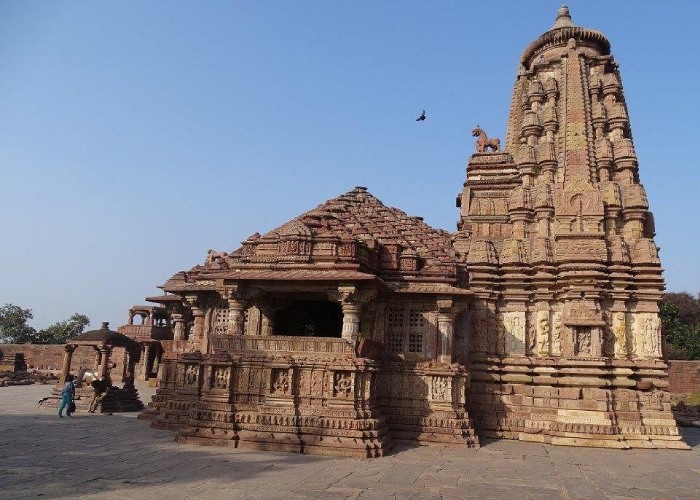
Locate an element on the screen. The image size is (700, 500). brick wall is located at coordinates (680, 375), (45, 356).